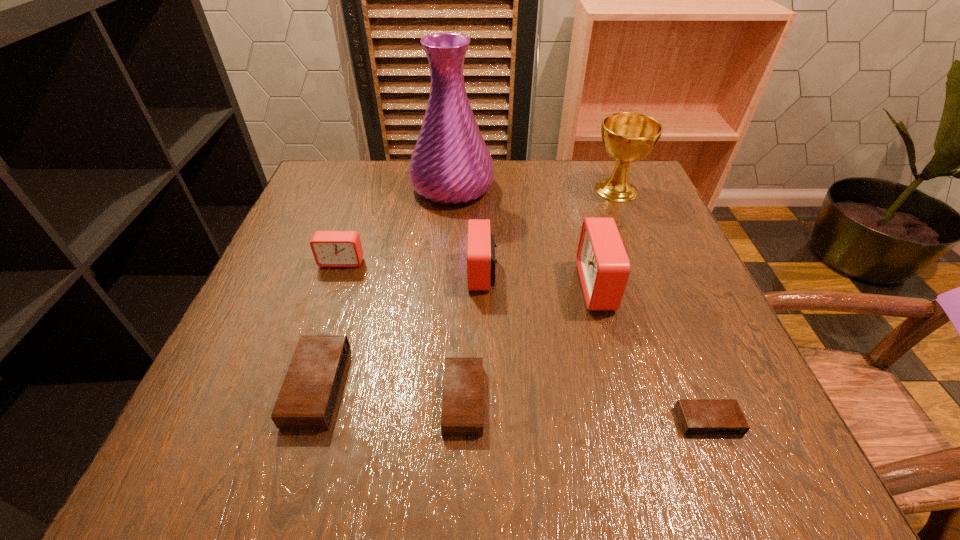
You are a GUI agent. You are given a task and a screenshot of the screen. Output one action in this format:
    pyautogui.click(x=<x>, y=<y>)
    Task: Click on the free region located 0.270m on the front-facing side of the third tallest object
    The height and width of the screenshot is (540, 960).
    Given the screenshot: What is the action you would take?
    pyautogui.click(x=443, y=286)

Locate an element on the screen. This screenshot has height=540, width=960. vacant space located 0.260m on the front-facing side of the second red alarm clock from left to right is located at coordinates (339, 273).

Where is `free point located on the front-facing side of the second red alarm clock from left to right`? This screenshot has width=960, height=540. free point located on the front-facing side of the second red alarm clock from left to right is located at coordinates (384, 273).

You are a GUI agent. You are given a task and a screenshot of the screen. Output one action in this format:
    pyautogui.click(x=<x>, y=<y>)
    Task: Click on the free space located on the front-facing side of the second red alarm clock from left to right
    The width and height of the screenshot is (960, 540).
    Given the screenshot: What is the action you would take?
    pyautogui.click(x=314, y=273)

Locate an element on the screen. blank area located 0.220m on the front-facing side of the third tallest alarm clock is located at coordinates (309, 357).

The width and height of the screenshot is (960, 540). I want to click on free space located 0.100m on the front face of the leftmost black alarm clock, so click(x=403, y=386).

Find the location of a particular element. This screenshot has width=960, height=540. vacant space located 0.270m on the front face of the second black alarm clock from right to left is located at coordinates (657, 400).

The height and width of the screenshot is (540, 960). I want to click on vase at the far edge, so click(x=450, y=164).

You are a GUI agent. You are given a task and a screenshot of the screen. Output one action in this format:
    pyautogui.click(x=<x>, y=<y>)
    Task: Click on the chalice present at the far edge
    
    Given the screenshot: What is the action you would take?
    pyautogui.click(x=627, y=137)

I want to click on chalice that is positioned at the right edge, so click(627, 137).